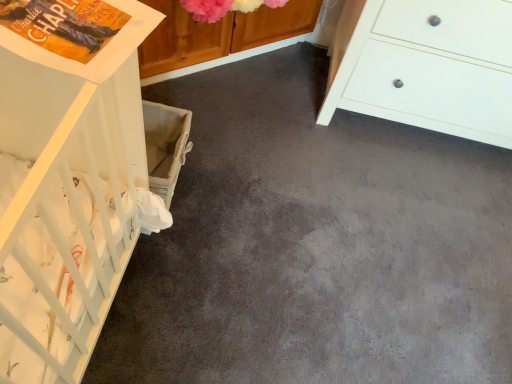
Image resolution: width=512 pixels, height=384 pixels. I want to click on vacant space in front of white matte chest of drawers at upper right, so [x=367, y=220].